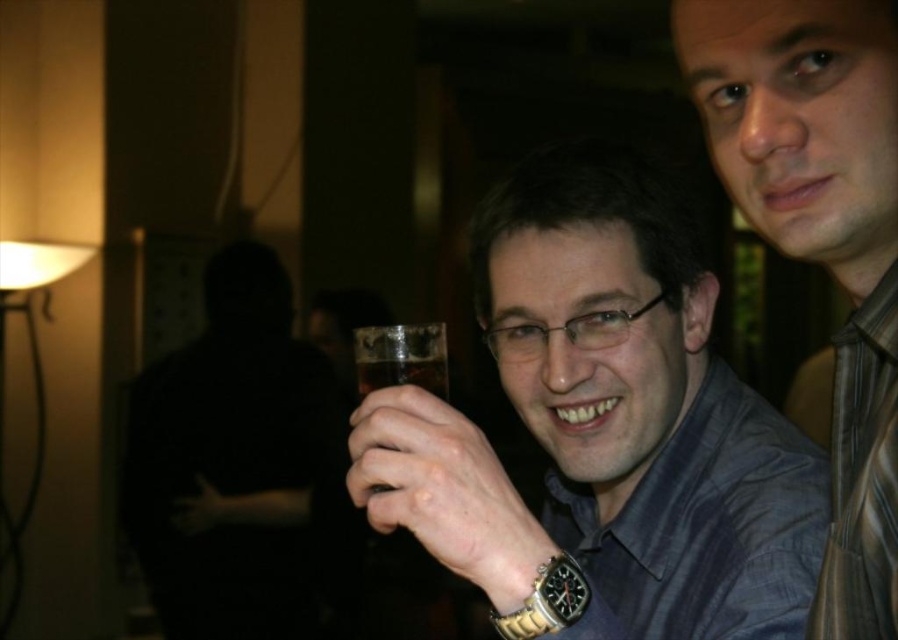
You are a photographer at the event and want to capture a closeup of the gold metallic watch at center and the clear glass at center. Since the camera can only focus on one object at a time, which object should you choose to ensure the larger one is in focus?

The gold metallic watch at center is larger in size than the clear glass at center, so you should focus on the gold metallic watch at center to ensure the larger object is in focus.

You are a photographer adjusting your camera settings to focus on the matte blue shirt at center and the gold metallic watch at center. Since the lighting is tricky, you need to know which object is closer to the camera. Can you determine which one is in front?

The matte blue shirt at center is in front of the gold metallic watch at center, so the shirt is closer to the camera.

In the scene shown: Where is the gold metallic watch at center located in the image?

The gold metallic watch at center is located at point (445, 492).